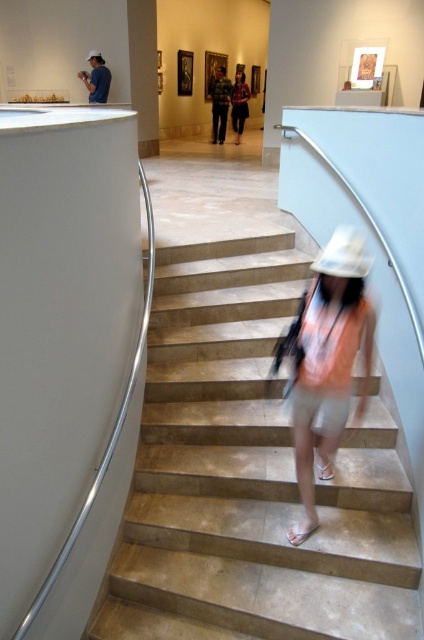
You are standing in the museum and want to take a photo of the beige marble stairs at center. Where should you position yourself to capture the stairs in the frame?

To capture the beige marble stairs at center in the frame, position yourself so that the stairs are centered at the coordinates 0.745 on the x axis and 0.590 on the y axis.

Looking at this image, you are standing at the bottom of the beige marble stairs at center in a museum. You need to reach the top of the stairs quickly. Considering the stairs are 2.29 meters away from you, can you estimate how many steps you would need to climb?

The beige marble stairs at center are 2.29 meters away from the viewer. Assuming an average step height of 0.15 meters, you would need to climb approximately 15 steps to reach the top.

You are planning to walk up the beige marble stairs at center while wearing the light pink fabric hat at center. Considering their sizes, will the hat obstruct your view when climbing the stairs?

The beige marble stairs at center are wider than the light pink fabric hat at center, so the hat should not obstruct your view while climbing the stairs.